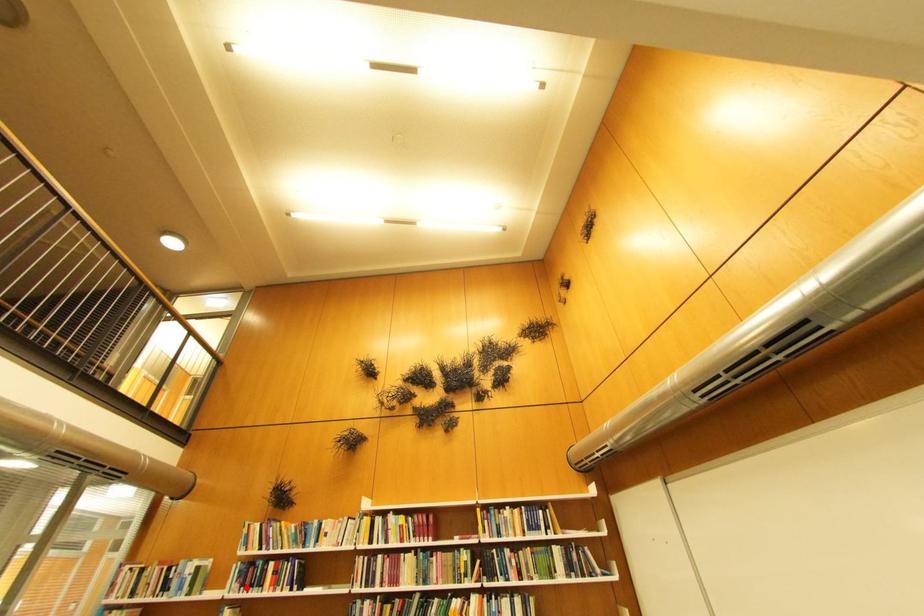
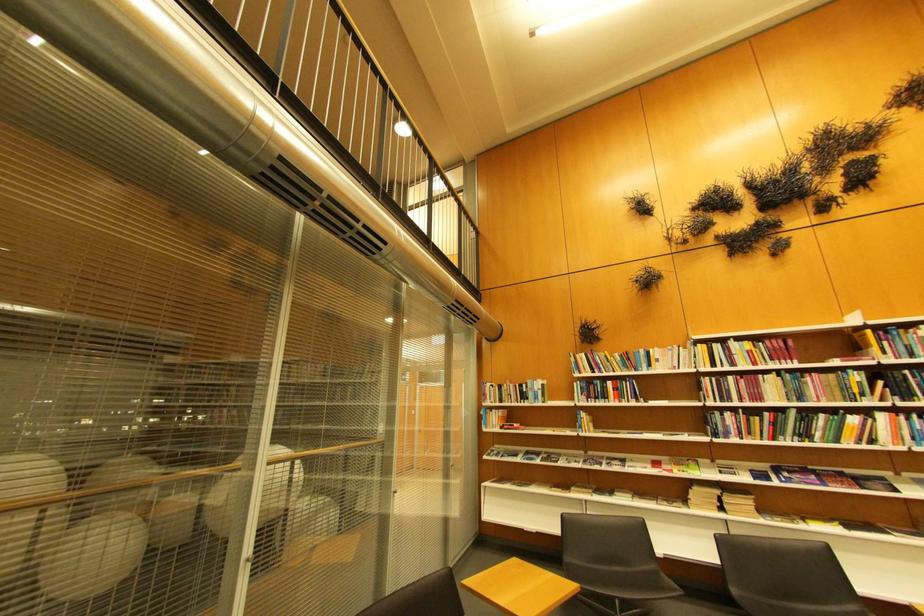
Question: I am providing you with two images of the same scene from different viewpoints. In image1, a red point is highlighted. Considering the same 3D point in image2, which of the following is correct?

Choices:
 (A) It is closer
 (B) It is farther

Answer: (B)